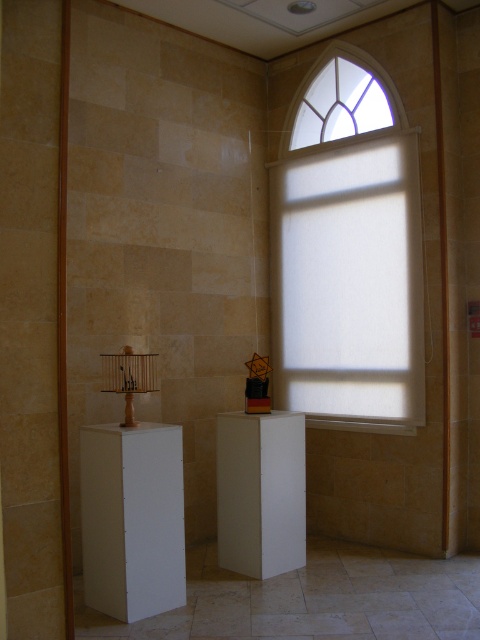
Between point (220, 440) and point (305, 116), which one is positioned behind?

Point (305, 116)

Locate an element on the screen. The image size is (480, 640). white matte pedestal at center is located at coordinates (261, 492).

Who is more distant from viewer, (245, 563) or (303, 108)?

Positioned behind is point (303, 108).

The width and height of the screenshot is (480, 640). I want to click on white matte pedestal at center, so click(x=261, y=492).

Based on the photo, does white matte pedestal at left appear under white matte pedestal at center?

Incorrect, white matte pedestal at left is not positioned below white matte pedestal at center.

Is white matte pedestal at left smaller than white matte pedestal at center?

Incorrect, white matte pedestal at left is not smaller in size than white matte pedestal at center.

You are a GUI agent. You are given a task and a screenshot of the screen. Output one action in this format:
    pyautogui.click(x=<x>, y=<y>)
    Task: Click on the white matte pedestal at left
    
    Given the screenshot: What is the action you would take?
    pyautogui.click(x=132, y=518)

Does white matte window at upper center have a greater width compared to clear glass window at upper center?

Yes, white matte window at upper center is wider than clear glass window at upper center.

Does point (288, 273) come in front of point (336, 97)?

No, (288, 273) is further to viewer.

Does point (380, 115) come behind point (322, 102)?

That is False.

What are the coordinates of `white matte window at upper center` in the screenshot? It's located at (348, 252).